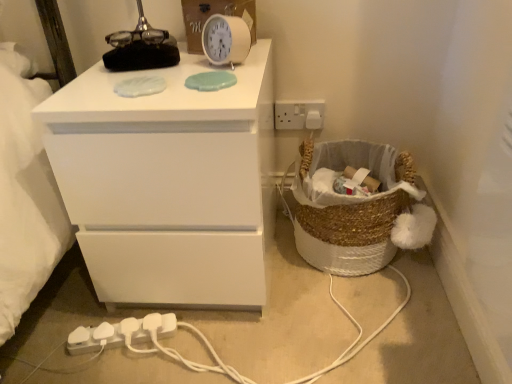
I want to click on vacant space that is to the left of white plastic extension cord at lower left, so click(49, 339).